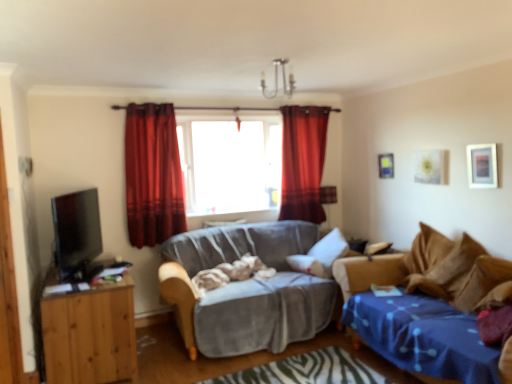
Measure the distance between transparent glass window at center and camera.

They are 4.47 meters apart.

The image size is (512, 384). Describe the element at coordinates (76, 232) in the screenshot. I see `black glossy tv at left` at that location.

Identify the location of velvet gray couch at center, placed as the 2th studio couch when sorted from right to left. The width and height of the screenshot is (512, 384). (247, 289).

The width and height of the screenshot is (512, 384). Describe the element at coordinates (429, 271) in the screenshot. I see `blue fabric studio couch at right, the 2th studio couch in the left-to-right sequence` at that location.

Image resolution: width=512 pixels, height=384 pixels. What do you see at coordinates (90, 335) in the screenshot?
I see `wooden cabinet at left` at bounding box center [90, 335].

In order to face wooden cabinet at left, should I rotate leftwards or rightwards?

A 21.591 degree turn to the left will do.

Locate an element on the screen. This screenshot has height=384, width=512. transparent glass window at center is located at coordinates (230, 165).

How distant is transparent glass window at center from wooden picture frame at upper right, which appears as the 2th picture frame when viewed from the left?

A distance of 2.40 meters exists between transparent glass window at center and wooden picture frame at upper right, which appears as the 2th picture frame when viewed from the left.

From the image's perspective, is transparent glass window at center above wooden picture frame at upper right, the second picture frame from the back?

Correct, transparent glass window at center appears higher than wooden picture frame at upper right, the second picture frame from the back, in the image.

In the scene shown: Is transparent glass window at center wider than wooden picture frame at upper right, which appears as the 2th picture frame when viewed from the left?

Indeed, transparent glass window at center has a greater width compared to wooden picture frame at upper right, which appears as the 2th picture frame when viewed from the left.

How many degrees apart are the facing directions of transparent glass window at center and wooden picture frame at upper right, the first picture frame from the right?

89.1 degrees separate the facing orientations of transparent glass window at center and wooden picture frame at upper right, the first picture frame from the right.

Can you confirm if velvet red curtain at center, which is counted as the 2th curtain, starting from the right, is shorter than wooden picture frame at upper right, marked as the 1th picture frame in a front-to-back arrangement?

No.

Is velvet red curtain at center, which is the 1th curtain from front to back, bigger than wooden picture frame at upper right, marked as the 1th picture frame in a front-to-back arrangement?

Indeed, velvet red curtain at center, which is the 1th curtain from front to back, has a larger size compared to wooden picture frame at upper right, marked as the 1th picture frame in a front-to-back arrangement.

Is velvet red curtain at center, the 2th curtain in the back-to-front sequence, further to camera compared to wooden picture frame at upper right, the first picture frame from the right?

Yes, velvet red curtain at center, the 2th curtain in the back-to-front sequence, is further from the camera.

Find the location of a particular element. The image size is (512, 384). curtain below the wooden picture frame at upper right, marked as the 1th picture frame in a front-to-back arrangement (from the image's perspective) is located at coordinates (153, 175).

Is velvet gray couch at center, placed as the first studio couch when sorted from left to right, facing away from blue fabric studio couch at right, the 2th studio couch in the left-to-right sequence?

velvet gray couch at center, placed as the first studio couch when sorted from left to right, is not turned away from blue fabric studio couch at right, the 2th studio couch in the left-to-right sequence.

Relative to blue fabric studio couch at right, the first studio couch viewed from the right, is velvet gray couch at center, placed as the 2th studio couch when sorted from right to left, in front or behind?

Visually, velvet gray couch at center, placed as the 2th studio couch when sorted from right to left, is located behind blue fabric studio couch at right, the first studio couch viewed from the right.

From the picture: Considering the relative sizes of velvet-like red curtain at center, which is counted as the first curtain, starting from the right, and black glossy tv at left in the image provided, is velvet-like red curtain at center, which is counted as the first curtain, starting from the right, thinner than black glossy tv at left?

Incorrect, the width of velvet-like red curtain at center, which is counted as the first curtain, starting from the right, is not less than that of black glossy tv at left.

Would you say velvet-like red curtain at center, which is counted as the 1th curtain, starting from the back, contains black glossy tv at left?

No.

Is point (303, 206) more distant than point (75, 223)?

Yes, it is.

Consider the image. How many degrees apart are the facing directions of velvet-like red curtain at center, which is the 2th curtain from front to back, and black glossy tv at left?

75.3 degrees separate the facing orientations of velvet-like red curtain at center, which is the 2th curtain from front to back, and black glossy tv at left.

From a real-world perspective, is metallic silver picture frame at upper center, the 2th picture frame in the front-to-back sequence, above or below black glossy tv at left?

Clearly, from a real-world perspective, metallic silver picture frame at upper center, the 2th picture frame in the front-to-back sequence, is above black glossy tv at left.

Who is bigger, metallic silver picture frame at upper center, the 1th picture frame from the left, or black glossy tv at left?

With larger size is black glossy tv at left.

Does metallic silver picture frame at upper center, the 2th picture frame in the front-to-back sequence, have a greater width compared to black glossy tv at left?

In fact, metallic silver picture frame at upper center, the 2th picture frame in the front-to-back sequence, might be narrower than black glossy tv at left.

Considering the positions of point (386, 153) and point (85, 241), is point (386, 153) closer or farther from the camera than point (85, 241)?

Point (386, 153) is farther from the camera than point (85, 241).

Between velvet gray couch at center, placed as the 2th studio couch when sorted from right to left, and wooden picture frame at upper right, the second picture frame from the back, which one appears on the right side from the viewer's perspective?

wooden picture frame at upper right, the second picture frame from the back.

From the velvet gray couch at center, placed as the 2th studio couch when sorted from right to left, count 1st picture frames backward and point to it. Please provide its 2D coordinates.

[(482, 165)]

Based on the photo, from a real-world perspective, between velvet gray couch at center, placed as the first studio couch when sorted from left to right, and wooden picture frame at upper right, the first picture frame from the right, who is vertically lower?

velvet gray couch at center, placed as the first studio couch when sorted from left to right, is physically lower.

Considering the relative sizes of velvet gray couch at center, placed as the first studio couch when sorted from left to right, and wooden picture frame at upper right, marked as the 1th picture frame in a front-to-back arrangement, in the image provided, is velvet gray couch at center, placed as the first studio couch when sorted from left to right, bigger than wooden picture frame at upper right, marked as the 1th picture frame in a front-to-back arrangement,?

Yes, velvet gray couch at center, placed as the first studio couch when sorted from left to right, is bigger than wooden picture frame at upper right, marked as the 1th picture frame in a front-to-back arrangement.

Which is more to the left, transparent glass window at center or velvet-like red curtain at center, which is counted as the first curtain, starting from the right?

Positioned to the left is transparent glass window at center.

Between transparent glass window at center and velvet-like red curtain at center, which is the 2th curtain from front to back, which one has more height?

With more height is velvet-like red curtain at center, which is the 2th curtain from front to back.

What's the angular difference between transparent glass window at center and velvet-like red curtain at center, which is the 2th curtain from front to back,'s facing directions?

They differ by 1.2 degrees in their facing directions.

Is transparent glass window at center wider than velvet-like red curtain at center, which is the 2th curtain from front to back?

Indeed, transparent glass window at center has a greater width compared to velvet-like red curtain at center, which is the 2th curtain from front to back.

Find the location of a particular element. The image size is (512, 384). the 2nd picture frame below the transparent glass window at center (from the image's perspective) is located at coordinates (482, 165).

The width and height of the screenshot is (512, 384). Find the location of `curtain that is the 1st object above the wooden picture frame at upper right, marked as the 1th picture frame in a front-to-back arrangement (from a real-world perspective)`. curtain that is the 1st object above the wooden picture frame at upper right, marked as the 1th picture frame in a front-to-back arrangement (from a real-world perspective) is located at coordinates (153, 175).

From the image, which object appears to be farther from velvet red curtain at center, marked as the 1th curtain in a left-to-right arrangement, metallic silver picture frame at upper center, the 2th picture frame in the front-to-back sequence, or velvet-like red curtain at center, which is counted as the first curtain, starting from the right?

metallic silver picture frame at upper center, the 2th picture frame in the front-to-back sequence, lies further to velvet red curtain at center, marked as the 1th curtain in a left-to-right arrangement, than the other object.

From the image, which object appears to be nearer to transparent glass window at center, velvet red curtain at center, the 2th curtain in the back-to-front sequence, or blue fabric studio couch at right, the first studio couch viewed from the right?

velvet red curtain at center, the 2th curtain in the back-to-front sequence.

Based on their spatial positions, is blue fabric studio couch at right, the first studio couch viewed from the right, or metallic silver picture frame at upper center, the 2th picture frame in the front-to-back sequence, further from wooden cabinet at left?

metallic silver picture frame at upper center, the 2th picture frame in the front-to-back sequence, is positioned further to the anchor wooden cabinet at left.

Which object lies further to the anchor point wooden cabinet at left, velvet-like red curtain at center, which is the 2th curtain from front to back, or blue fabric studio couch at right, the 2th studio couch in the left-to-right sequence?

velvet-like red curtain at center, which is the 2th curtain from front to back, is further to wooden cabinet at left.

Which object lies further to the anchor point wooden picture frame at upper right, marked as the 1th picture frame in a front-to-back arrangement, velvet gray couch at center, placed as the first studio couch when sorted from left to right, or velvet red curtain at center, which is the 1th curtain from front to back?

velvet red curtain at center, which is the 1th curtain from front to back.

Estimate the real-world distances between objects in this image. Which object is further from metallic silver picture frame at upper center, the 2th picture frame in the front-to-back sequence, velvet-like red curtain at center, which is the 2th curtain from front to back, or velvet gray couch at center, placed as the 2th studio couch when sorted from right to left?

velvet gray couch at center, placed as the 2th studio couch when sorted from right to left.

Looking at the image, which one is located closer to velvet gray couch at center, placed as the first studio couch when sorted from left to right, black glossy tv at left or transparent glass window at center?

The object closer to velvet gray couch at center, placed as the first studio couch when sorted from left to right, is transparent glass window at center.

Looking at the image, which one is located further to velvet red curtain at center, marked as the 1th curtain in a left-to-right arrangement, velvet-like red curtain at center, which is counted as the 1th curtain, starting from the back, or metallic silver picture frame at upper center, the 2th picture frame in the front-to-back sequence?

The object further to velvet red curtain at center, marked as the 1th curtain in a left-to-right arrangement, is metallic silver picture frame at upper center, the 2th picture frame in the front-to-back sequence.

This screenshot has height=384, width=512. What are the coordinates of `studio couch located between black glossy tv at left and metallic silver picture frame at upper center, the 2th picture frame in the front-to-back sequence, in the left-right direction` in the screenshot? It's located at (247, 289).

What are the coordinates of `window between black glossy tv at left and wooden picture frame at upper right, marked as the 1th picture frame in a front-to-back arrangement` in the screenshot? It's located at (230, 165).

Where is `open that lies between velvet red curtain at center, which is the 1th curtain from front to back, and wooden cabinet at left from top to bottom`? open that lies between velvet red curtain at center, which is the 1th curtain from front to back, and wooden cabinet at left from top to bottom is located at coordinates (76, 232).

The width and height of the screenshot is (512, 384). Identify the location of curtain between velvet gray couch at center, placed as the 2th studio couch when sorted from right to left, and wooden picture frame at upper right, marked as the 1th picture frame in a front-to-back arrangement, from left to right. (303, 162).